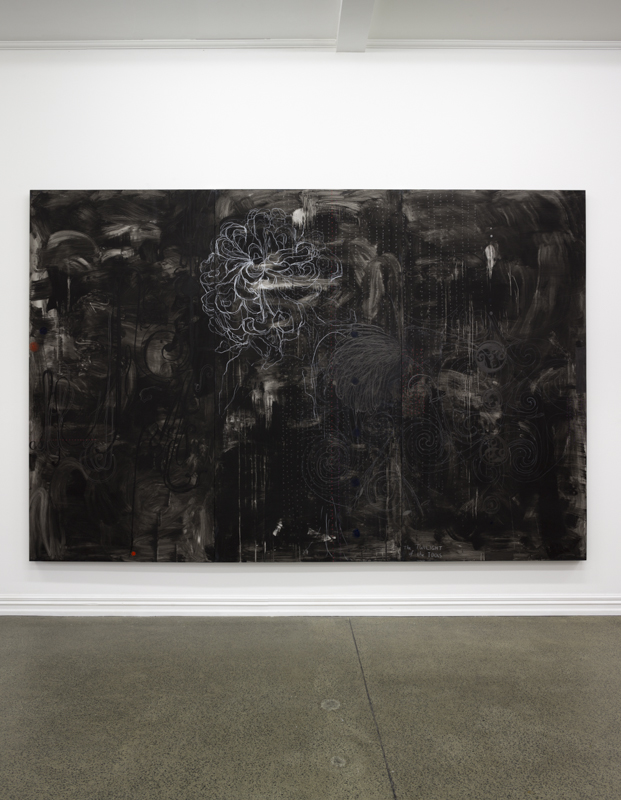
This screenshot has width=621, height=800. Identify the location of water stains on floor. (333, 702), (336, 758).